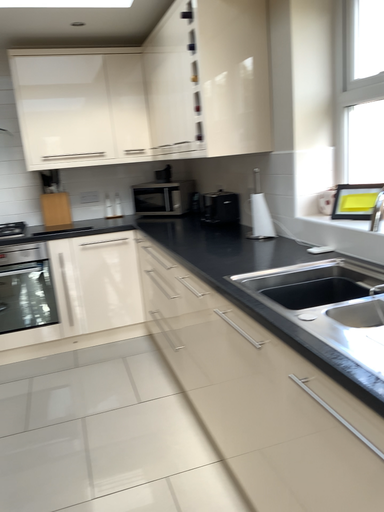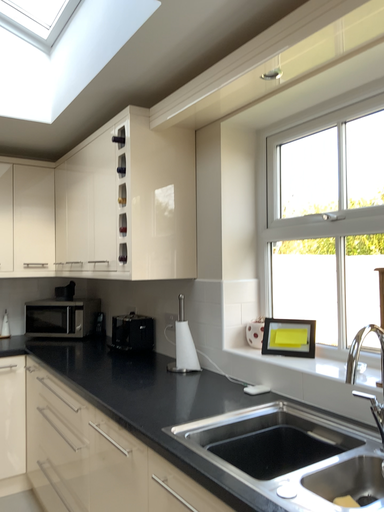
Question: Which way did the camera rotate in the video?

Choices:
 (A) rotated downward
 (B) rotated upward

Answer: (B)